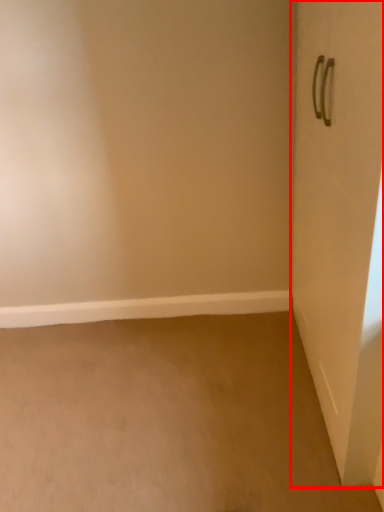
Question: Considering the relative positions of door (annotated by the red box) and window sill in the image provided, where is door (annotated by the red box) located with respect to the staircase?

Choices:
 (A) left
 (B) right

Answer: (B)